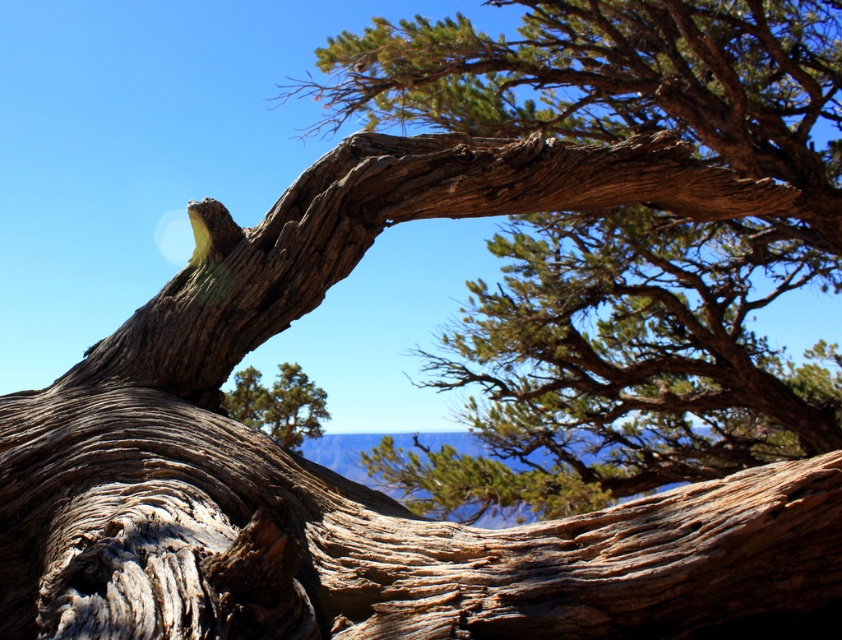
Can you confirm if rough bark tree at upper center is wider than green textured pine tree at center?

Yes, rough bark tree at upper center is wider than green textured pine tree at center.

Measure the distance between rough bark tree at upper center and camera.

They are 5.15 meters apart.

Image resolution: width=842 pixels, height=640 pixels. What do you see at coordinates (621, 244) in the screenshot?
I see `rough bark tree at upper center` at bounding box center [621, 244].

At what (x,y) coordinates should I click in order to perform the action: click on rough bark tree at upper center. Please return your answer as a coordinate pair (x, y). Looking at the image, I should click on (621, 244).